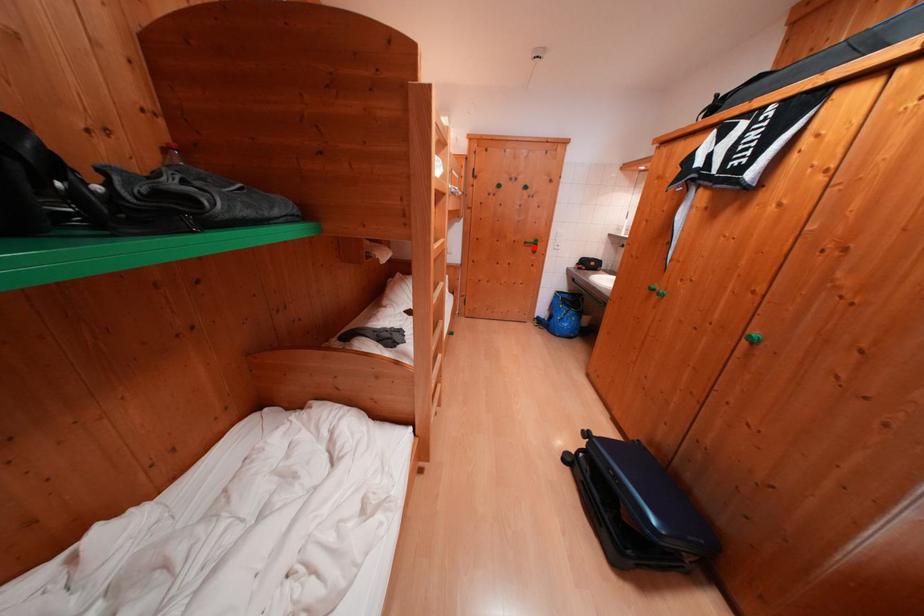
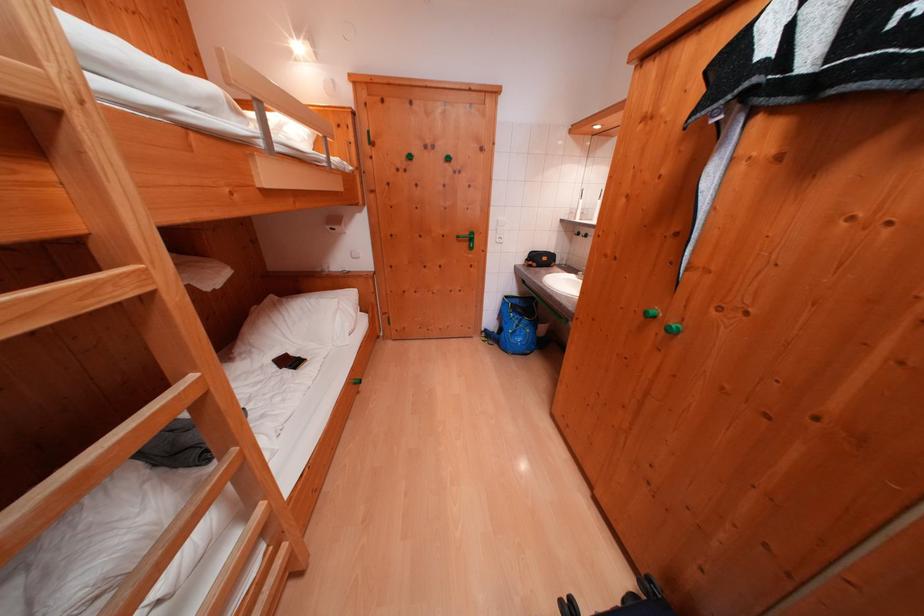
Question: I am providing you with two images of the same scene from different viewpoints. Given a red point in image1, look at the same physical point in image2. Is it:

Choices:
 (A) Closer to the viewpoint
 (B) Farther from the viewpoint

Answer: (A)